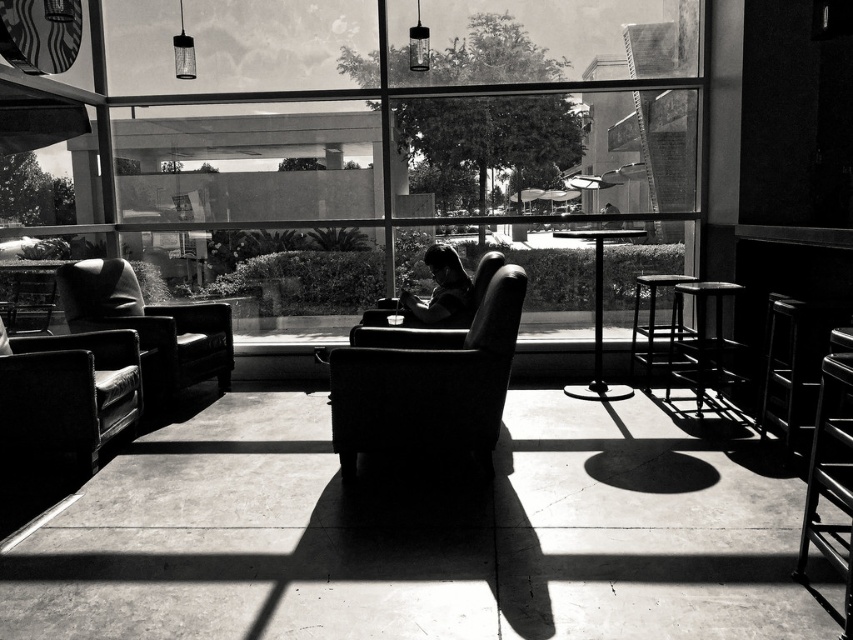
Consider the image. You are standing in the lounge and want to determine which of the two points, point (x=454, y=444) or point (x=448, y=248), is nearer to you. Based on the scene description, which point is closer?

Point (x=454, y=444) is closer to the viewer than point (x=448, y=248).

In the scene shown: You are standing in the lounge and want to place a large potted plant on the metallic black table at center. However, you need to ensure there is enough space between the table and the transparent glass window at center. Can you confirm if there is sufficient space between them?

The transparent glass window at center is to the left of the metallic black table at center, so there is space between them for placing the potted plant.